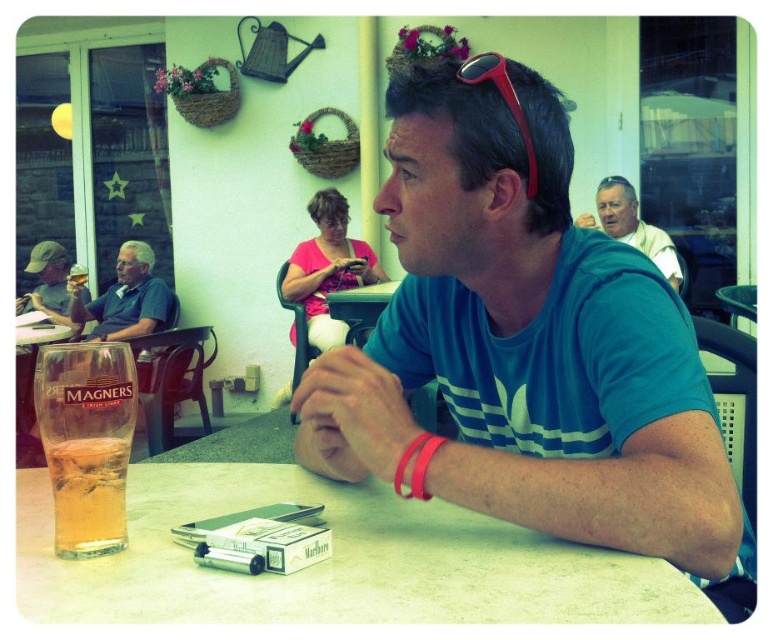
You are a photographer trying to capture the scene. You notice the blue fabric shirt at center and the clear plastic table at center. Which object should you focus on first if you want to emphasize something bigger in your composition?

The blue fabric shirt at center is larger in size than the clear plastic table at center, so focusing on the blue fabric shirt at center would emphasize the bigger object in the composition.

You are designing a new tablecloth for the clear plastic table at center. The blue fabric shirt at center is currently placed on the table. Considering the size of the shirt, will it completely cover the table?

The blue fabric shirt at center has a lesser width compared to clear plastic table at center, so it will not completely cover the table.